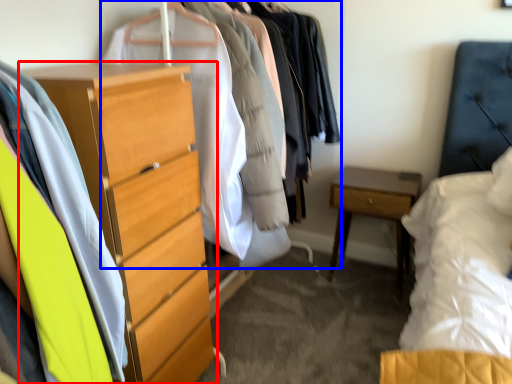
Question: Which object is further to the camera taking this photo, chest of drawers (highlighted by a red box) or closet (highlighted by a blue box)?

Choices:
 (A) chest of drawers
 (B) closet

Answer: (B)